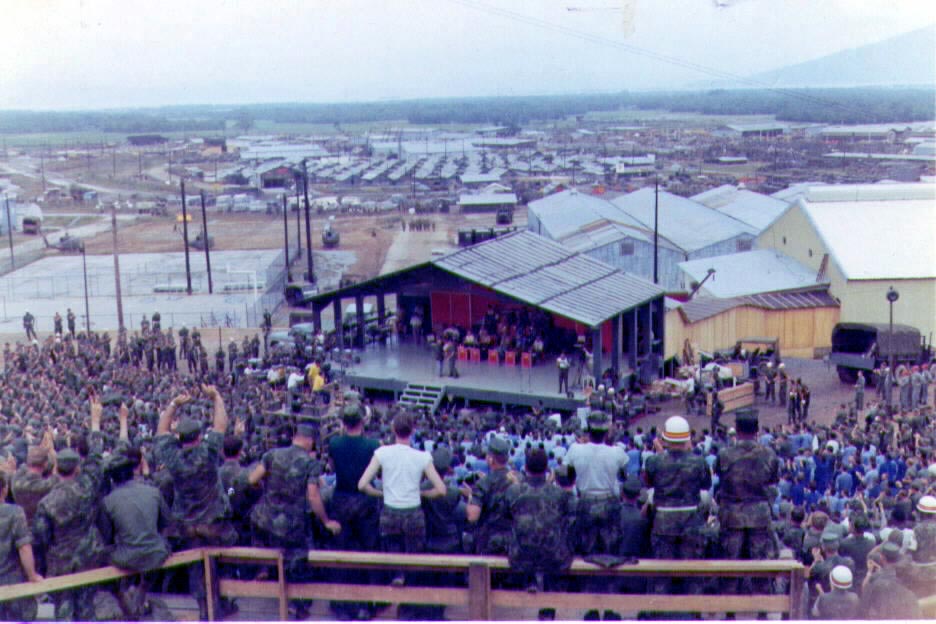
You are a GUI agent. You are given a task and a screenshot of the screen. Output one action in this format:
    pyautogui.click(x=<x>, y=<y>)
    Task: Click on the stage
    The image size is (936, 624).
    Given the screenshot: What is the action you would take?
    tap(512, 383)